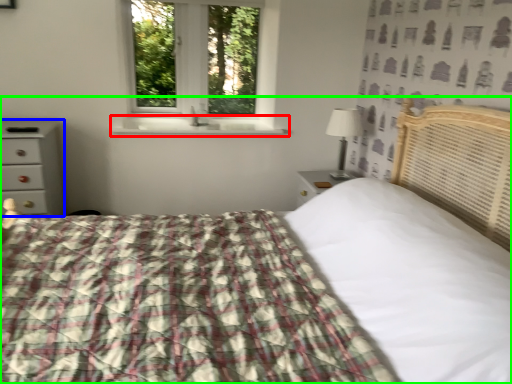
Question: Estimate the real-world distances between objects in this image. Which object is farther from window sill (highlighted by a red box), chest of drawers (highlighted by a blue box) or bed (highlighted by a green box)?

Choices:
 (A) chest of drawers
 (B) bed

Answer: (B)